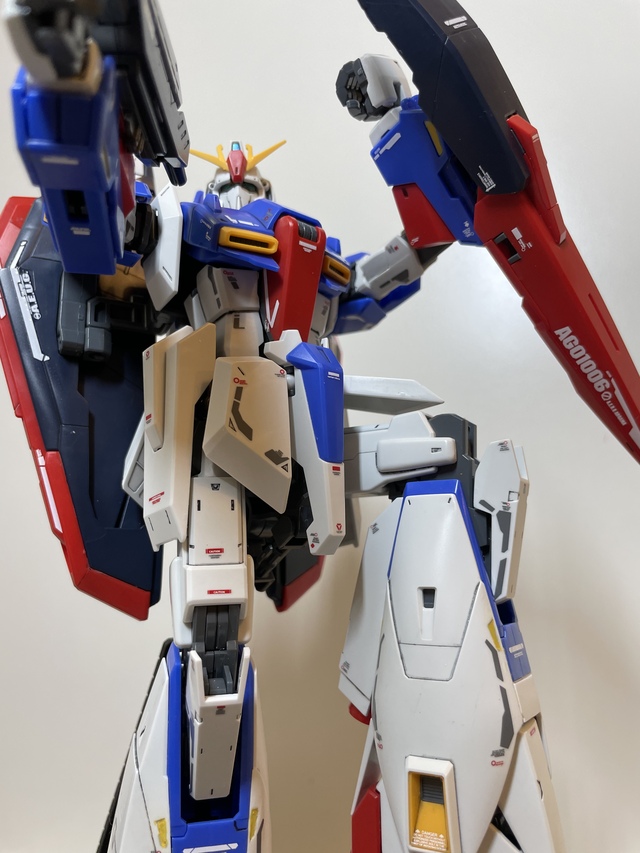
Locate an element on the screen. vents is located at coordinates (249, 242), (333, 269).